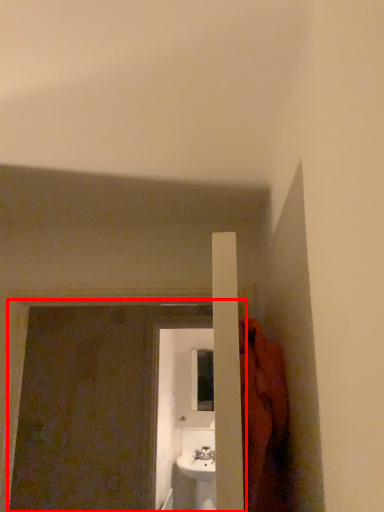
Question: From the image's perspective, where is screen door (annotated by the red box) located relative to screen door?

Choices:
 (A) above
 (B) below

Answer: (A)